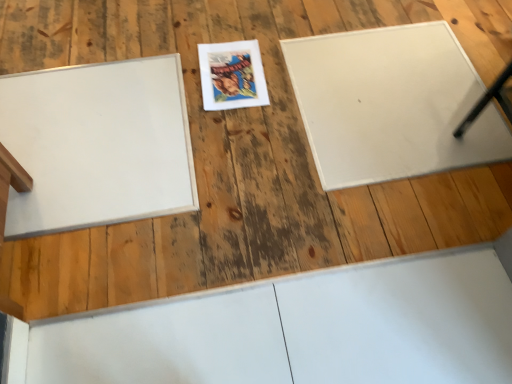
You are a GUI agent. You are given a task and a screenshot of the screen. Output one action in this format:
    pyautogui.click(x=<x>, y=<y>)
    Task: Click on the free space between white matte board at left, which appears as the 2th bulletin board when viewed from the right, and white matte board at upper right, which is the 2th bulletin board in left-to-right order
    This screenshot has width=512, height=384.
    Given the screenshot: What is the action you would take?
    pyautogui.click(x=247, y=136)